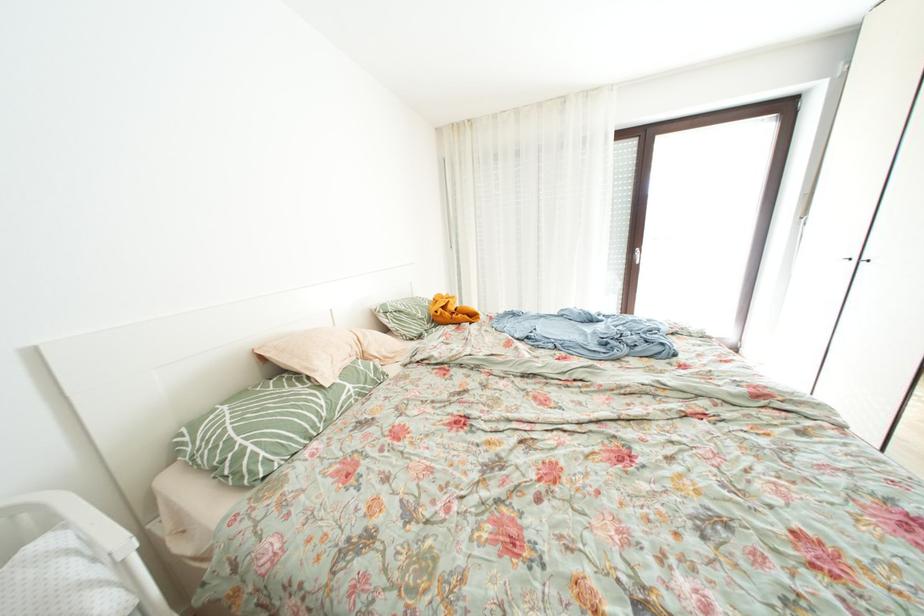
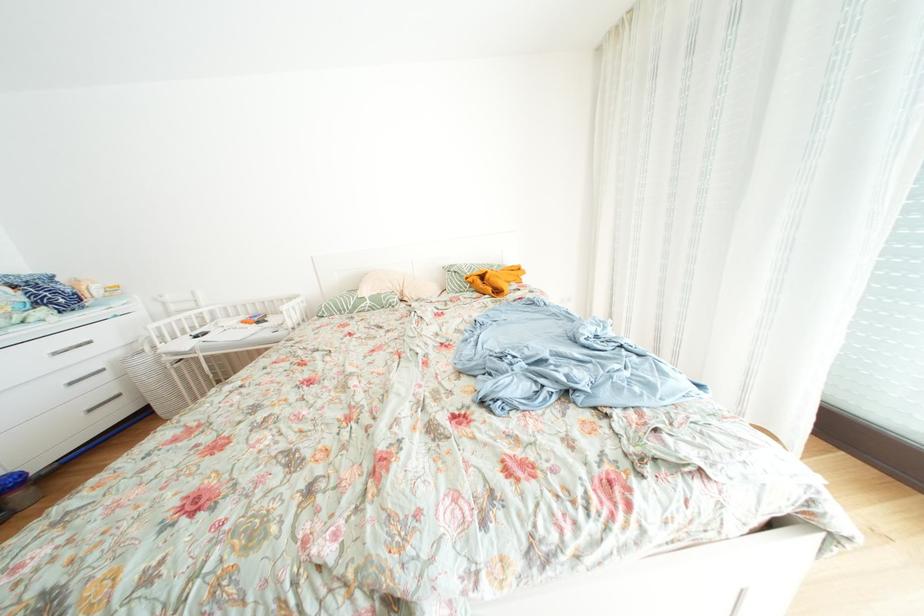
Find the pixel in the second image that matches [359,391] in the first image.

(378, 307)